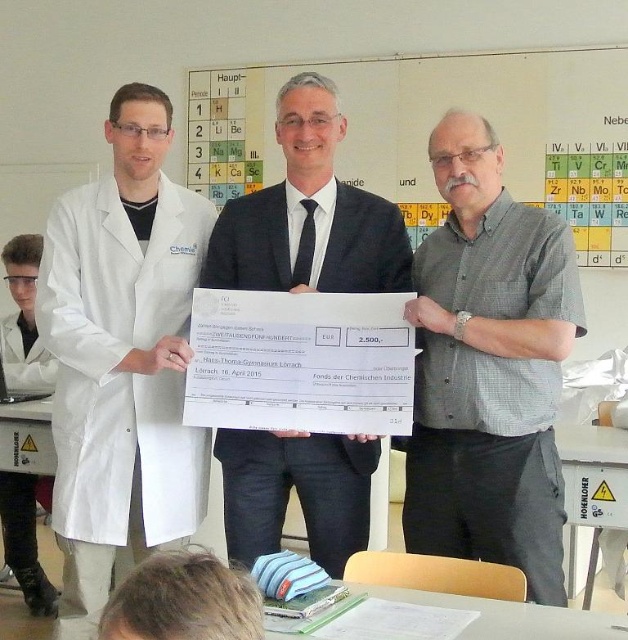
You are organizing a photo shoot and need to ensure that all elements in the scene are visible. Given the white lab coat at left and the yellow periodic table at upper center, which object should you focus on first to ensure proper framing?

The yellow periodic table at upper center should be focused on first because it is larger than the white lab coat at left, making it a more prominent element in the scene.

You are a photographer at the back of the classroom during the ceremony. You want to take a photo of the white lab coat at center and the yellow periodic table at upper center. Which object will appear larger in your photo?

The yellow periodic table at upper center will appear larger in the photo because it is closer to the photographer than the white lab coat at center.

You are standing at the point labeled point (117,202) and want to hand a document to someone across the room. The distance between you and them is 6.92 feet. If the document is 1 foot thick, can you throw it to them without it falling?

The distance between you and the point labeled point (117,202) is 6.92 feet. Since the document is 1 foot thick, throwing it that distance might be challenging as it could easily fall or misdirect. It would be safer to walk over and hand it directly.